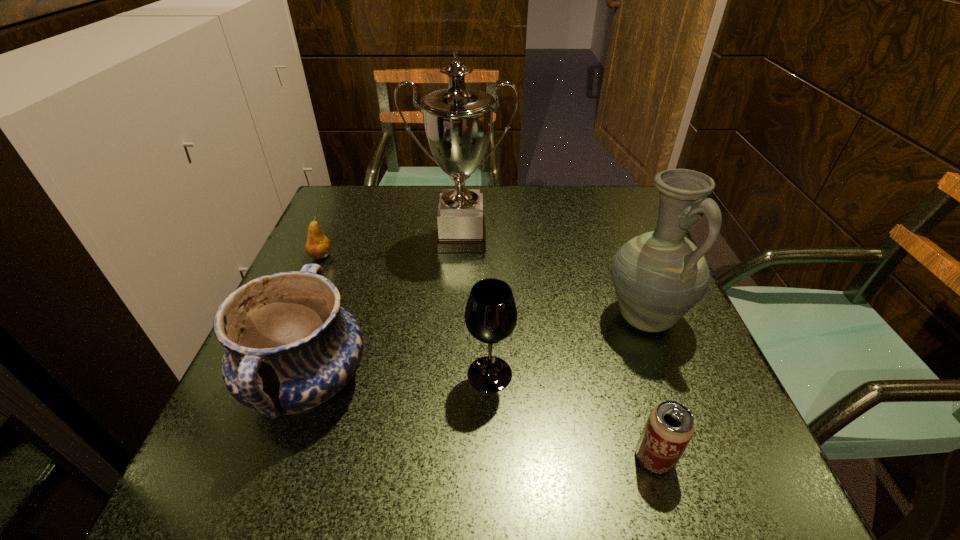
This screenshot has height=540, width=960. In order to click on vacant area between the wineglass and the fifth shortest object in this screenshot , I will do `click(566, 346)`.

Where is `vacant region between the pear and the wineglass`? This screenshot has width=960, height=540. vacant region between the pear and the wineglass is located at coordinates (405, 315).

Locate an element on the screen. This screenshot has height=540, width=960. object that is the nearest to the wineglass is located at coordinates (290, 346).

At what (x,y) coordinates should I click in order to perform the action: click on object that is the closest to the pottery. Please return your answer as a coordinate pair (x, y). Looking at the image, I should click on (491, 315).

You are a GUI agent. You are given a task and a screenshot of the screen. Output one action in this format:
    pyautogui.click(x=<x>, y=<y>)
    Task: Click on the blank space that satisfies the following two spatial constraints: 1. on the back side of the wineglass; 2. on the right side of the pottery
    The height and width of the screenshot is (540, 960).
    Given the screenshot: What is the action you would take?
    pyautogui.click(x=310, y=374)